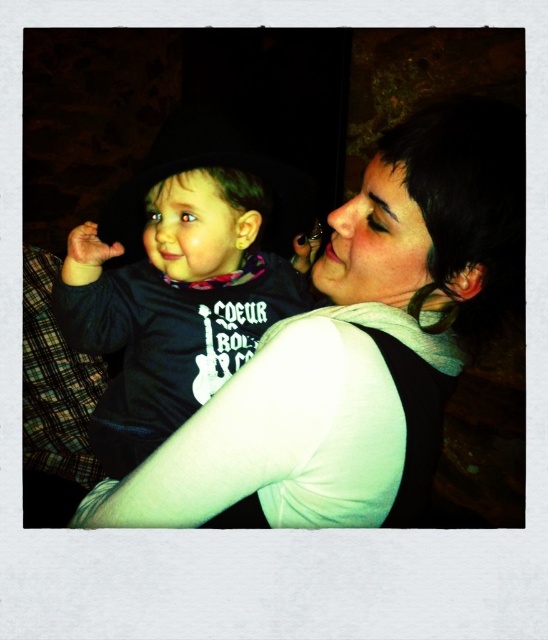
Question: Which point appears farthest from the camera in this image?

Choices:
 (A) (461, 108)
 (B) (265, 179)

Answer: (B)

Question: Is matte black shirt at center smaller than matte black hoodie at center?

Choices:
 (A) no
 (B) yes

Answer: (A)

Question: Which of the following is the closest to the observer?

Choices:
 (A) matte black shirt at center
 (B) matte black hoodie at center

Answer: (A)

Question: Which of the following is the closest to the observer?

Choices:
 (A) (117, 474)
 (B) (447, 131)

Answer: (B)

Question: Can you confirm if matte black shirt at center is smaller than matte black hoodie at center?

Choices:
 (A) yes
 (B) no

Answer: (B)

Question: Can you confirm if matte black shirt at center is positioned below matte black hoodie at center?

Choices:
 (A) no
 (B) yes

Answer: (B)